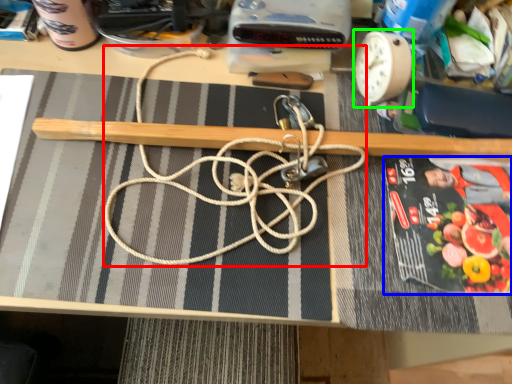
Question: Based on their relative distances, which object is nearer to string (highlighted by a red box)? Choose from paperback book (highlighted by a blue box) and clock (highlighted by a green box).

Choices:
 (A) paperback book
 (B) clock

Answer: (A)